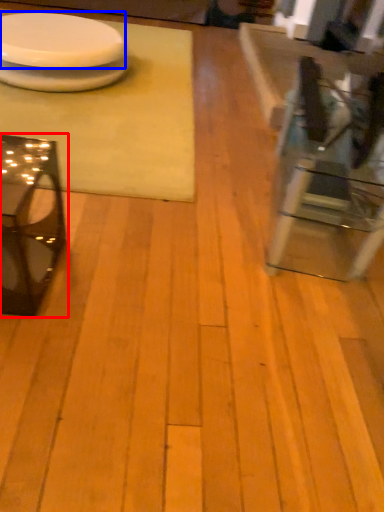
Question: Among these objects, which one is farthest to the camera, table (highlighted by a red box) or platter (highlighted by a blue box)?

Choices:
 (A) table
 (B) platter

Answer: (B)